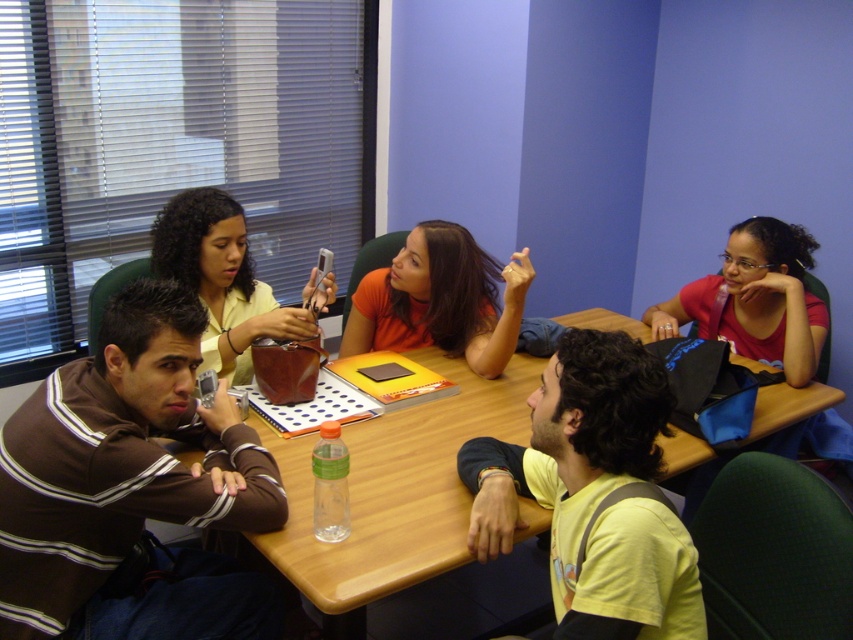
Which is below, brown striped sweater at center or matte red shirt at upper right?

brown striped sweater at center

Based on the photo, measure the distance between brown striped sweater at center and camera.

brown striped sweater at center is 1.39 meters from camera.

Who is more distant from viewer, (48, 593) or (761, 298)?

The point (761, 298) is behind.

Locate an element on the screen. The image size is (853, 640). brown striped sweater at center is located at coordinates (129, 484).

How much distance is there between yellow matte shirt at center and orange fabric shirt at center?

They are 28.80 inches apart.

Can you confirm if yellow matte shirt at center is wider than orange fabric shirt at center?

Incorrect, yellow matte shirt at center's width does not surpass orange fabric shirt at center's.

Identify the location of yellow matte shirt at center. (592, 492).

Locate an element on the screen. Image resolution: width=853 pixels, height=640 pixels. yellow matte shirt at center is located at coordinates (592, 492).

Between point (148, 316) and point (641, 362), which one is positioned in front?

Positioned in front is point (641, 362).

Who is more forward, (x=55, y=474) or (x=599, y=636)?

Point (x=599, y=636) is in front.

Find the location of `brown striped sweater at center`. brown striped sweater at center is located at coordinates (129, 484).